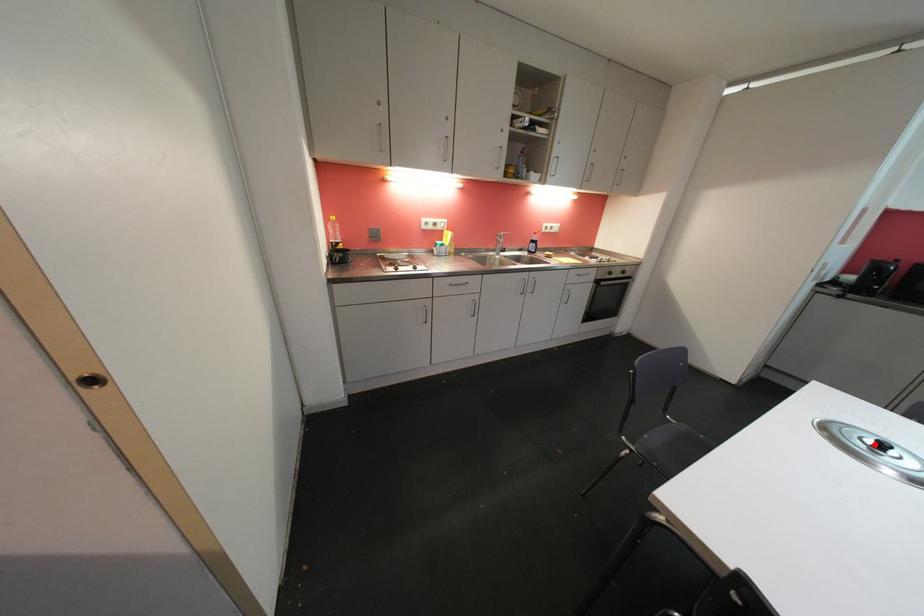
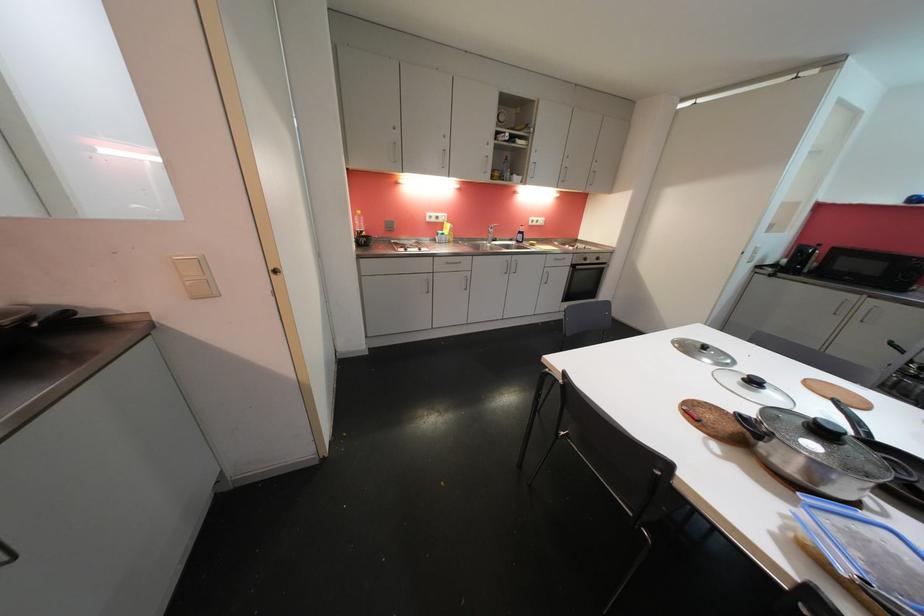
The point at the highlighted location is marked in the first image. Where is the corresponding point in the second image?

(703, 349)